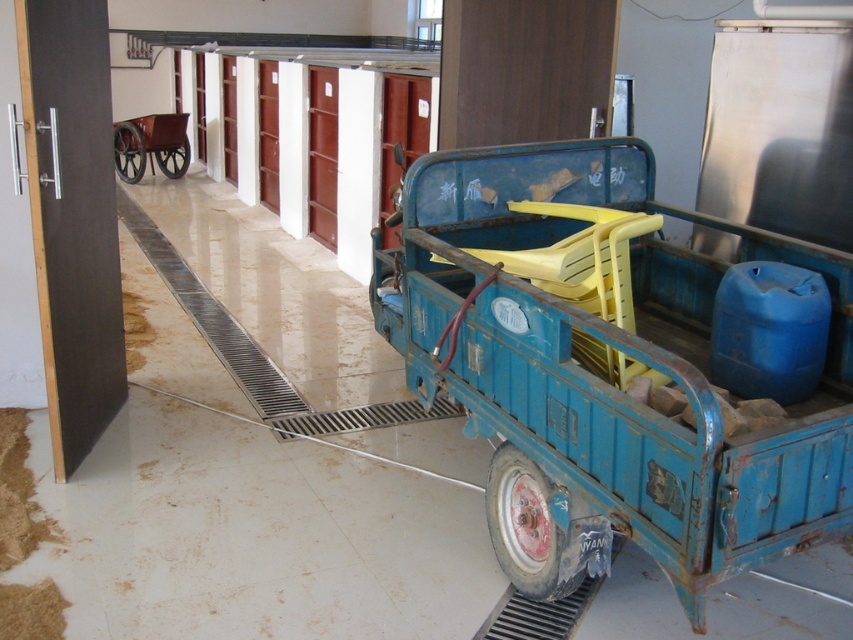
Is rusty blue metal wagon at center positioned behind wooden wagon at left?

No, rusty blue metal wagon at center is in front of wooden wagon at left.

From the picture: Between rusty blue metal wagon at center and wooden wagon at left, which one appears on the left side from the viewer's perspective?

From the viewer's perspective, wooden wagon at left appears more on the left side.

Locate an element on the screen. rusty blue metal wagon at center is located at coordinates (x=605, y=368).

In the scene shown: Who is positioned more to the right, rusty blue metal wagon at center or rubber/smooth tire at center?

rusty blue metal wagon at center is more to the right.

Is rusty blue metal wagon at center shorter than rubber/smooth tire at center?

No.

This screenshot has height=640, width=853. Identify the location of rusty blue metal wagon at center. [605, 368].

Does rusty blue metal wagon at center appear under rustic metal wheel at center?

Yes, rusty blue metal wagon at center is below rustic metal wheel at center.

Who is taller, rusty blue metal wagon at center or rustic metal wheel at center?

rusty blue metal wagon at center is taller.

Image resolution: width=853 pixels, height=640 pixels. Describe the element at coordinates (605, 368) in the screenshot. I see `rusty blue metal wagon at center` at that location.

Identify the location of rusty blue metal wagon at center. This screenshot has width=853, height=640. tap(605, 368).